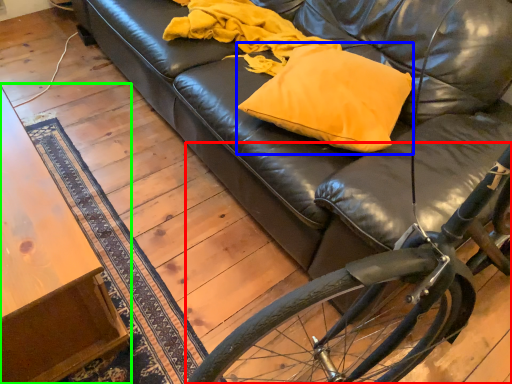
Question: Which object is positioned farthest from bicycle (highlighted by a red box)? Select from throw pillow (highlighted by a blue box) and table (highlighted by a green box).

Choices:
 (A) throw pillow
 (B) table

Answer: (B)